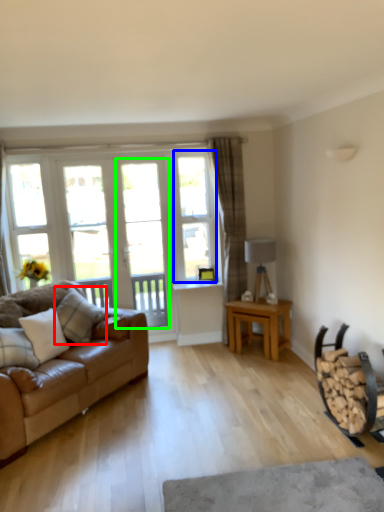
Question: Which object is the closest to the pillow (highlighted by a red box)? Choose among these: window (highlighted by a blue box) or screen door (highlighted by a green box).

Choices:
 (A) window
 (B) screen door

Answer: (B)